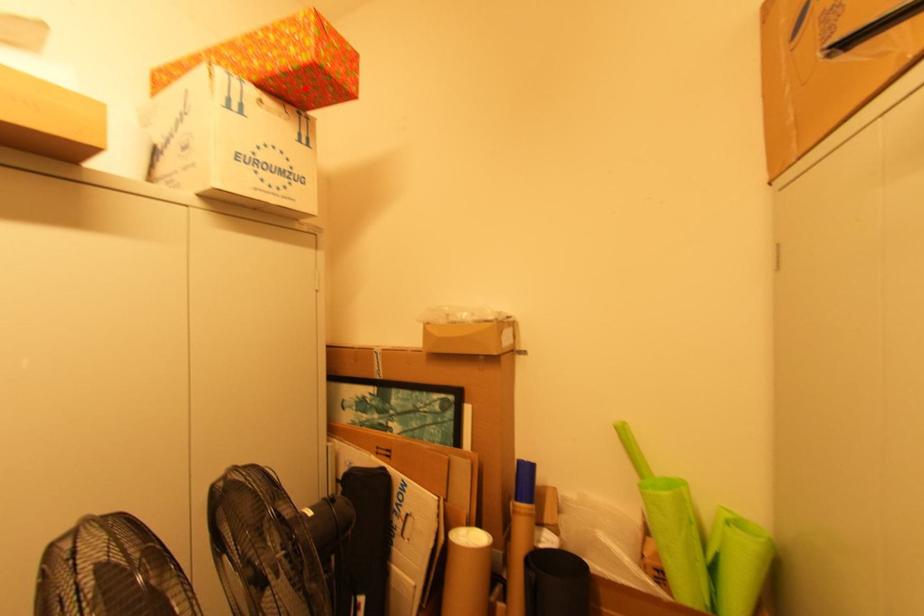
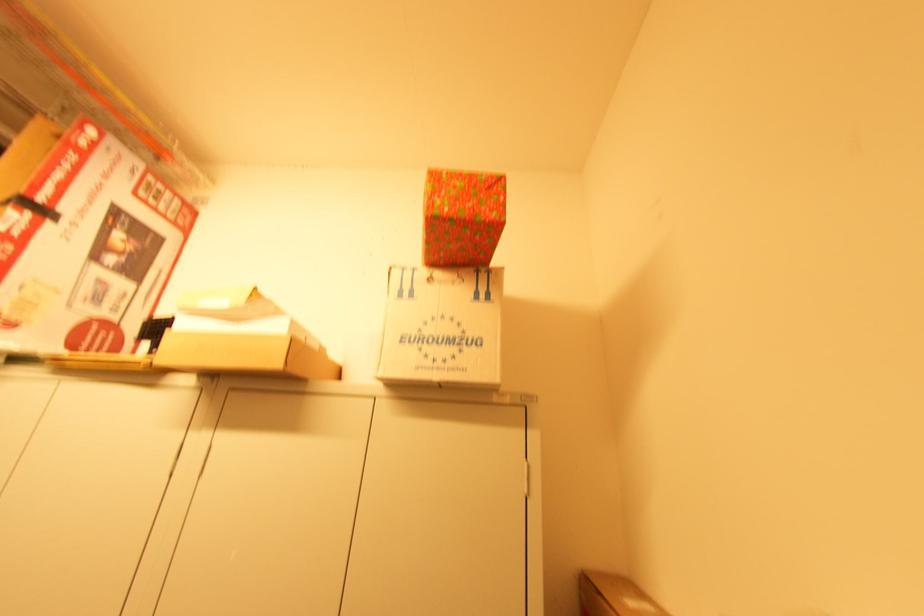
Locate, in the second image, the point that corresponds to the highlighted location in the first image.

(454, 246)